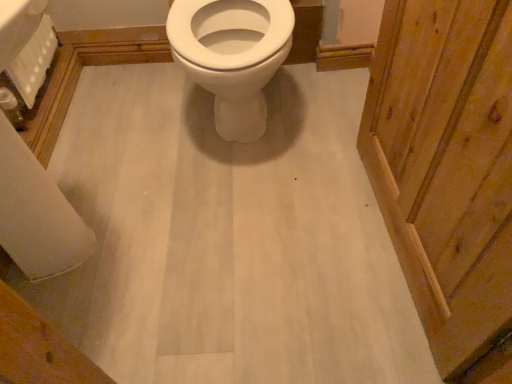
How much space does white textured toilet paper at upper left, the 1th toilet paper positioned from the left, occupy vertically?

It is 6.68 inches.

Identify the location of white glossy toilet at center. (232, 55).

What do you see at coordinates (36, 213) in the screenshot? I see `white matte toilet paper at lower left, which is counted as the 1th toilet paper, starting from the right` at bounding box center [36, 213].

Where is `white textured toilet paper at upper left, which appears as the 2th toilet paper when viewed from the right`? This screenshot has width=512, height=384. white textured toilet paper at upper left, which appears as the 2th toilet paper when viewed from the right is located at coordinates (33, 62).

Between point (19, 54) and point (20, 144), which one is positioned in front?

The point (19, 54) is more forward.

Could you tell me if white textured toilet paper at upper left, which appears as the 2th toilet paper when viewed from the right, is turned towards white matte toilet paper at lower left, the second toilet paper viewed from the left?

No, white textured toilet paper at upper left, which appears as the 2th toilet paper when viewed from the right, is not oriented towards white matte toilet paper at lower left, the second toilet paper viewed from the left.

In the scene shown: Considering the sizes of objects white textured toilet paper at upper left, the 1th toilet paper positioned from the left, and white matte toilet paper at lower left, the second toilet paper viewed from the left, in the image provided, who is thinner, white textured toilet paper at upper left, the 1th toilet paper positioned from the left, or white matte toilet paper at lower left, the second toilet paper viewed from the left,?

With smaller width is white matte toilet paper at lower left, the second toilet paper viewed from the left.

Locate an element on the screen. The width and height of the screenshot is (512, 384). toilet paper positioned vertically above the white matte toilet paper at lower left, the second toilet paper viewed from the left (from a real-world perspective) is located at coordinates (33, 62).

Locate an element on the screen. This screenshot has height=384, width=512. toilet paper above the white matte toilet paper at lower left, the second toilet paper viewed from the left (from the image's perspective) is located at coordinates (33, 62).

Considering the relative sizes of white matte toilet paper at lower left, which is counted as the 1th toilet paper, starting from the right, and white textured toilet paper at upper left, which appears as the 2th toilet paper when viewed from the right, in the image provided, is white matte toilet paper at lower left, which is counted as the 1th toilet paper, starting from the right, thinner than white textured toilet paper at upper left, which appears as the 2th toilet paper when viewed from the right,?

Yes, white matte toilet paper at lower left, which is counted as the 1th toilet paper, starting from the right, is thinner than white textured toilet paper at upper left, which appears as the 2th toilet paper when viewed from the right.

Consider the image. Could you tell me if white matte toilet paper at lower left, which is counted as the 1th toilet paper, starting from the right, is facing white textured toilet paper at upper left, the 1th toilet paper positioned from the left?

No, white matte toilet paper at lower left, which is counted as the 1th toilet paper, starting from the right, does not turn towards white textured toilet paper at upper left, the 1th toilet paper positioned from the left.

From the picture: From a real-world perspective, is white textured toilet paper at upper left, the 1th toilet paper positioned from the left, positioned above or below white glossy toilet at center?

white textured toilet paper at upper left, the 1th toilet paper positioned from the left, is below white glossy toilet at center.

At what (x,y) coordinates should I click in order to perform the action: click on bidet that appears above the white textured toilet paper at upper left, the 1th toilet paper positioned from the left (from the image's perspective). Please return your answer as a coordinate pair (x, y). Looking at the image, I should click on (232, 55).

Based on their sizes in the image, would you say white textured toilet paper at upper left, which appears as the 2th toilet paper when viewed from the right, is bigger or smaller than white glossy toilet at center?

In the image, white textured toilet paper at upper left, which appears as the 2th toilet paper when viewed from the right, appears to be smaller than white glossy toilet at center.

Is white matte toilet paper at lower left, the second toilet paper viewed from the left, at the right side of white glossy toilet at center?

No, white matte toilet paper at lower left, the second toilet paper viewed from the left, is not to the right of white glossy toilet at center.

Where is `toilet paper that is the 1st one when counting backward from the white glossy toilet at center`? toilet paper that is the 1st one when counting backward from the white glossy toilet at center is located at coordinates (36, 213).

Which of these two, white matte toilet paper at lower left, which is counted as the 1th toilet paper, starting from the right, or white glossy toilet at center, is thinner?

Thinner between the two is white matte toilet paper at lower left, which is counted as the 1th toilet paper, starting from the right.

Visually, is white glossy toilet at center positioned to the left or to the right of white matte toilet paper at lower left, which is counted as the 1th toilet paper, starting from the right?

Clearly, white glossy toilet at center is on the right of white matte toilet paper at lower left, which is counted as the 1th toilet paper, starting from the right, in the image.

How many degrees apart are the facing directions of white glossy toilet at center and white matte toilet paper at lower left, the second toilet paper viewed from the left?

There is a 89.1-degree angle between the facing directions of white glossy toilet at center and white matte toilet paper at lower left, the second toilet paper viewed from the left.

From the image's perspective, does white glossy toilet at center appear lower than white matte toilet paper at lower left, the second toilet paper viewed from the left?

No, from the image's perspective, white glossy toilet at center is not beneath white matte toilet paper at lower left, the second toilet paper viewed from the left.

From the image's perspective, starting from the white glossy toilet at center, which toilet paper is the 2nd one below? Please provide its 2D coordinates.

[(36, 213)]

Is white glossy toilet at center in front of or behind white textured toilet paper at upper left, which appears as the 2th toilet paper when viewed from the right, in the image?

white glossy toilet at center is in front of white textured toilet paper at upper left, which appears as the 2th toilet paper when viewed from the right.

From the image's perspective, would you say white glossy toilet at center is shown under white textured toilet paper at upper left, the 1th toilet paper positioned from the left?

Incorrect, from the image's perspective, white glossy toilet at center is higher than white textured toilet paper at upper left, the 1th toilet paper positioned from the left.

Is white glossy toilet at center turned away from white textured toilet paper at upper left, the 1th toilet paper positioned from the left?

No, white glossy toilet at center is not facing the opposite direction of white textured toilet paper at upper left, the 1th toilet paper positioned from the left.

Locate an element on the screen. toilet paper in front of the white textured toilet paper at upper left, the 1th toilet paper positioned from the left is located at coordinates (36, 213).

Where is `toilet paper above the white matte toilet paper at lower left, which is counted as the 1th toilet paper, starting from the right (from the image's perspective)`? Image resolution: width=512 pixels, height=384 pixels. toilet paper above the white matte toilet paper at lower left, which is counted as the 1th toilet paper, starting from the right (from the image's perspective) is located at coordinates (33, 62).

Consider the image. Considering their positions, is white glossy toilet at center positioned further to white textured toilet paper at upper left, the 1th toilet paper positioned from the left, than white matte toilet paper at lower left, the second toilet paper viewed from the left?

Among the two, white glossy toilet at center is located further to white textured toilet paper at upper left, the 1th toilet paper positioned from the left.

Which object lies further to the anchor point white textured toilet paper at upper left, the 1th toilet paper positioned from the left, white matte toilet paper at lower left, the second toilet paper viewed from the left, or white glossy toilet at center?

The object further to white textured toilet paper at upper left, the 1th toilet paper positioned from the left, is white glossy toilet at center.

Estimate the real-world distances between objects in this image. Which object is closer to white matte toilet paper at lower left, the second toilet paper viewed from the left, white textured toilet paper at upper left, the 1th toilet paper positioned from the left, or white glossy toilet at center?

white textured toilet paper at upper left, the 1th toilet paper positioned from the left.

When comparing their distances from white glossy toilet at center, does white textured toilet paper at upper left, which appears as the 2th toilet paper when viewed from the right, or white matte toilet paper at lower left, the second toilet paper viewed from the left, seem further?

Among the two, white matte toilet paper at lower left, the second toilet paper viewed from the left, is located further to white glossy toilet at center.

From the image, which object appears to be nearer to white glossy toilet at center, white matte toilet paper at lower left, the second toilet paper viewed from the left, or white textured toilet paper at upper left, which appears as the 2th toilet paper when viewed from the right?

The object closer to white glossy toilet at center is white textured toilet paper at upper left, which appears as the 2th toilet paper when viewed from the right.

Considering their positions, is white glossy toilet at center positioned closer to white matte toilet paper at lower left, which is counted as the 1th toilet paper, starting from the right, than white textured toilet paper at upper left, the 1th toilet paper positioned from the left?

white textured toilet paper at upper left, the 1th toilet paper positioned from the left, is positioned closer to the anchor white matte toilet paper at lower left, which is counted as the 1th toilet paper, starting from the right.

The image size is (512, 384). What are the coordinates of `toilet paper located between white textured toilet paper at upper left, which appears as the 2th toilet paper when viewed from the right, and white glossy toilet at center in the left-right direction` in the screenshot? It's located at (36, 213).